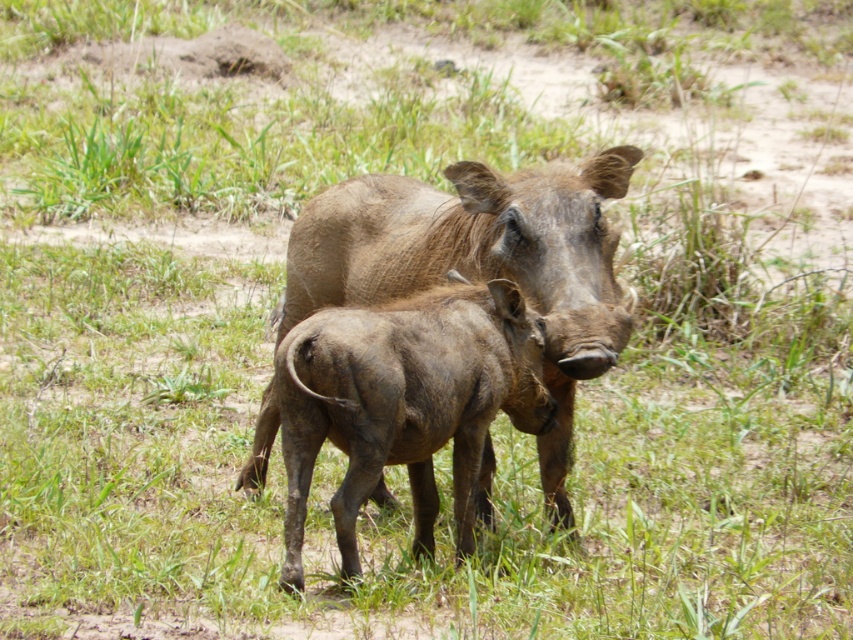
Question: Which object is farther from the camera taking this photo?

Choices:
 (A) brown textured warthog at center
 (B) brown textured pig at center

Answer: (A)

Question: Can you confirm if brown textured pig at center is positioned below brown textured warthog at center?

Choices:
 (A) no
 (B) yes

Answer: (A)

Question: Can you confirm if brown textured pig at center is positioned to the right of brown textured warthog at center?

Choices:
 (A) yes
 (B) no

Answer: (A)

Question: Is brown textured pig at center further to the viewer compared to brown textured warthog at center?

Choices:
 (A) yes
 (B) no

Answer: (B)

Question: Which point is closer to the camera?

Choices:
 (A) brown textured warthog at center
 (B) brown textured pig at center

Answer: (B)